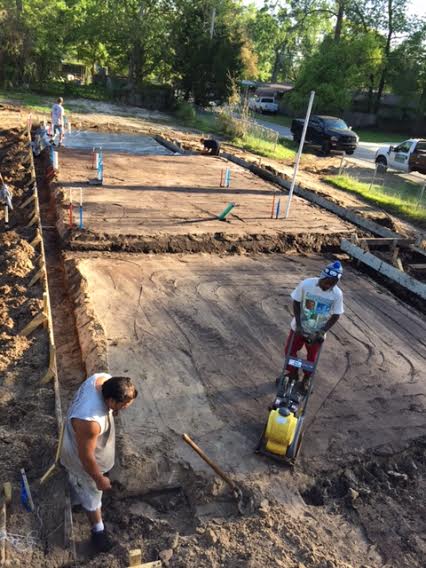
Identify the location of vent pipe. The image size is (426, 568). (295, 171).